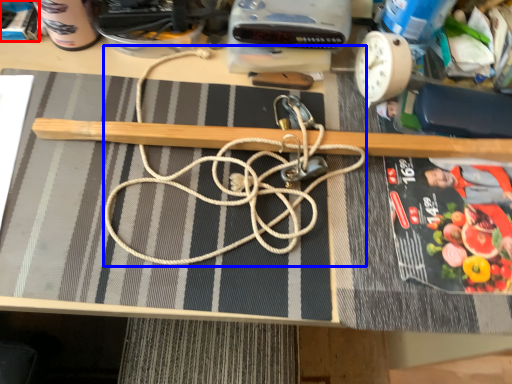
Question: Among these objects, which one is nearest to the camera, paperback book (highlighted by a red box) or string (highlighted by a blue box)?

Choices:
 (A) paperback book
 (B) string

Answer: (B)